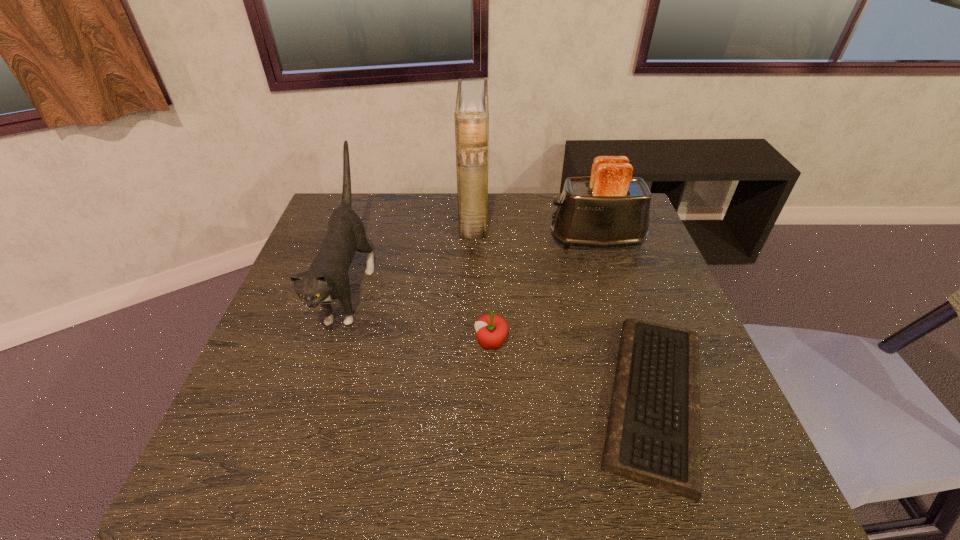
The height and width of the screenshot is (540, 960). I want to click on vacant space positioned on the side of the third shortest object with the control lever, so click(508, 240).

Where is `vacant space located on the right of the apple`? The height and width of the screenshot is (540, 960). vacant space located on the right of the apple is located at coordinates (664, 343).

Locate an element on the screen. Image resolution: width=960 pixels, height=540 pixels. vacant space located 0.150m on the left of the computer keyboard is located at coordinates (513, 399).

This screenshot has width=960, height=540. I want to click on phonebook that is at the far edge, so click(x=471, y=114).

Locate an element on the screen. toaster that is positioned at the far edge is located at coordinates 610,208.

The height and width of the screenshot is (540, 960). I want to click on object located at the near edge, so click(653, 437).

Where is `object that is at the left edge`? This screenshot has height=540, width=960. object that is at the left edge is located at coordinates (327, 279).

I want to click on toaster at the right edge, so click(x=610, y=208).

What are the coordinates of `computer keyboard that is at the right edge` in the screenshot? It's located at (653, 437).

Locate an element on the screen. object that is at the far right corner is located at coordinates (610, 208).